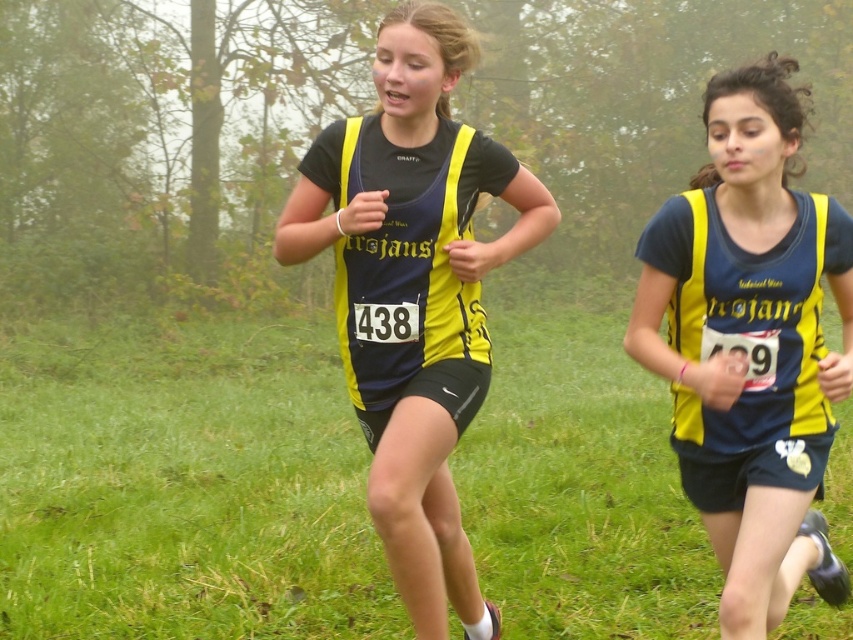
Question: Does matte yellow vest at center have a smaller size compared to yellow matte vest at center?

Choices:
 (A) yes
 (B) no

Answer: (A)

Question: Is matte yellow vest at center positioned before yellow matte vest at center?

Choices:
 (A) yes
 (B) no

Answer: (A)

Question: Is matte yellow vest at center smaller than yellow matte vest at center?

Choices:
 (A) yes
 (B) no

Answer: (A)

Question: Which point is closer to the camera?

Choices:
 (A) (459, 372)
 (B) (756, 458)

Answer: (B)

Question: Among these points, which one is nearest to the camera?

Choices:
 (A) (648, 323)
 (B) (415, 566)

Answer: (A)